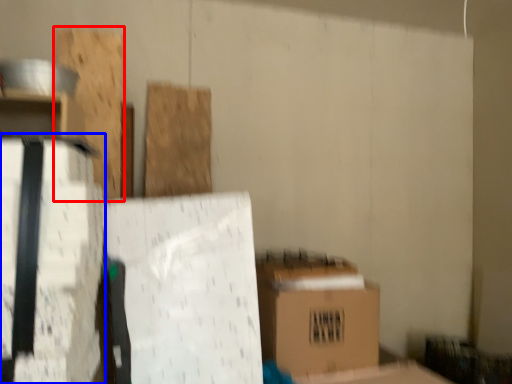
Question: Among these objects, which one is nearest to the camera, wood (highlighted by a red box) or cardboard box (highlighted by a blue box)?

Choices:
 (A) wood
 (B) cardboard box

Answer: (B)